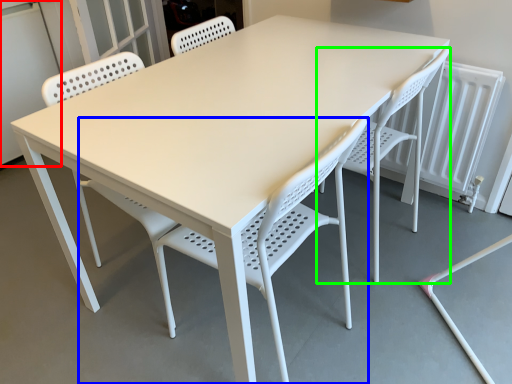
Question: Which object is the closest to the screen door (highlighted by a red box)? Choose among these: chair (highlighted by a blue box) or chair (highlighted by a green box).

Choices:
 (A) chair
 (B) chair

Answer: (A)